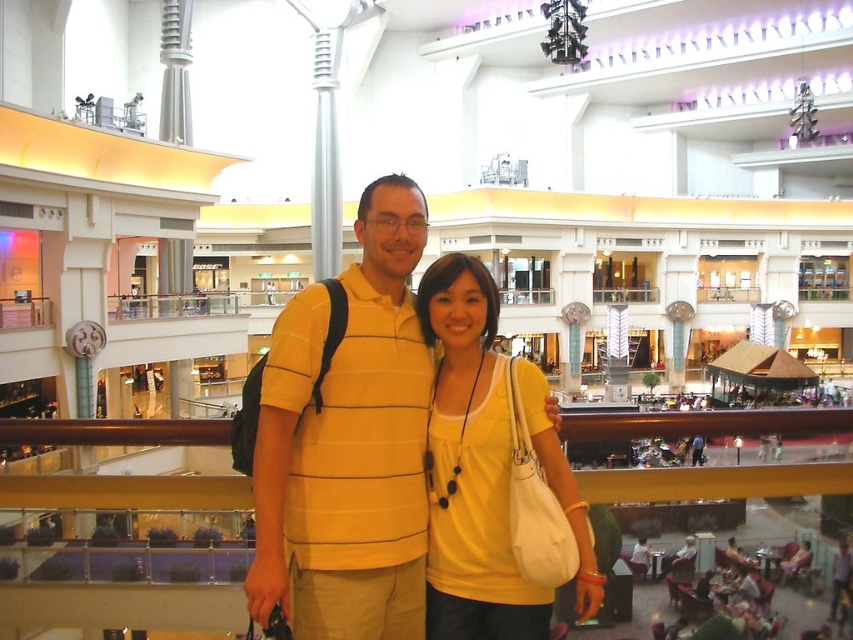
You are a photographer trying to capture a detailed shot of both the yellow striped polo shirt at center and the yellow matte tank top at center. Since they are both yellow, how can you distinguish which one is closer to the camera?

The yellow striped polo shirt at center is positioned over the yellow matte tank top at center, so the one covering the other is closer to the camera.

You are a photographer trying to capture the two people in the scene. Which clothing item is on the left side when looking at the yellow striped polo shirt at center and the yellow matte tank top at center?

The yellow striped polo shirt at center is positioned on the left side of the yellow matte tank top at center.

You are standing in the shopping mall and want to take a photo of both the point at (277, 387) and the point at (583, 538). Which point will appear closer to the camera in the photo?

Point at (277, 387) will appear closer to the camera in the photo because it is further to the camera than point at (583, 538).